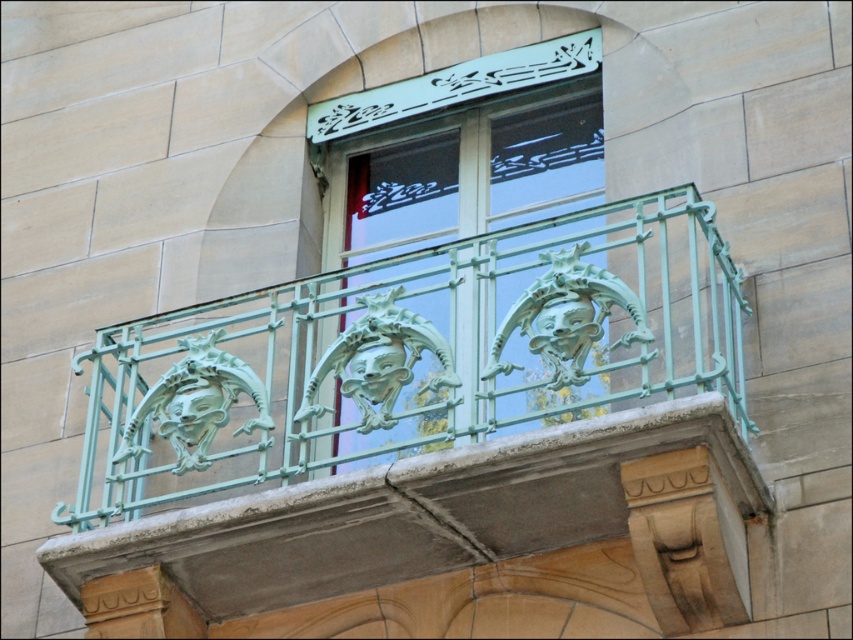
Is green patina metal at upper center thinner than smooth beige stone at lower right?

In fact, green patina metal at upper center might be wider than smooth beige stone at lower right.

Does green patina metal at upper center have a smaller size compared to smooth beige stone at lower right?

Correct, green patina metal at upper center occupies less space than smooth beige stone at lower right.

Find the location of a particular element. Image resolution: width=853 pixels, height=640 pixels. green patina metal at upper center is located at coordinates (457, 150).

The image size is (853, 640). I want to click on green patina metal at upper center, so click(x=457, y=150).

Does green patina metal railing at center have a greater height compared to smooth beige stone at lower right?

Correct, green patina metal railing at center is much taller as smooth beige stone at lower right.

Which is above, green patina metal railing at center or smooth beige stone at lower right?

Positioned higher is green patina metal railing at center.

Who is more forward, [663,493] or [630,518]?

Point [630,518]

You are a GUI agent. You are given a task and a screenshot of the screen. Output one action in this format:
    pyautogui.click(x=<x>, y=<y>)
    Task: Click on the green patina metal railing at center
    The image size is (853, 640).
    Given the screenshot: What is the action you would take?
    pyautogui.click(x=427, y=432)

Measure the distance between green patina metal railing at center and green patina metal at upper center.

45.97 feet

Between green patina metal railing at center and green patina metal at upper center, which one has less height?

With less height is green patina metal at upper center.

Is point (350, 563) positioned in front of point (485, 109)?

Yes.

Locate an element on the screen. green patina metal railing at center is located at coordinates (427, 432).